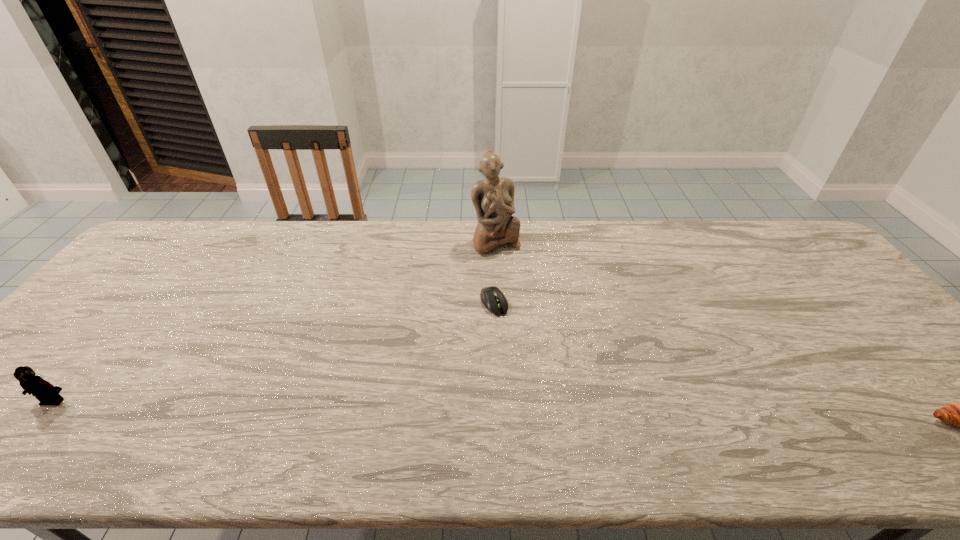
I want to click on vacant space on the desktop that is between the third shortest object and the second shortest object and is positioned on the wheel side of the shortest object, so click(x=559, y=412).

This screenshot has height=540, width=960. What are the coordinates of `vacant spot on the desktop that is between the second nearest object and the second shortest object and is positioned on the front-facing side of the figurine` in the screenshot? It's located at (576, 413).